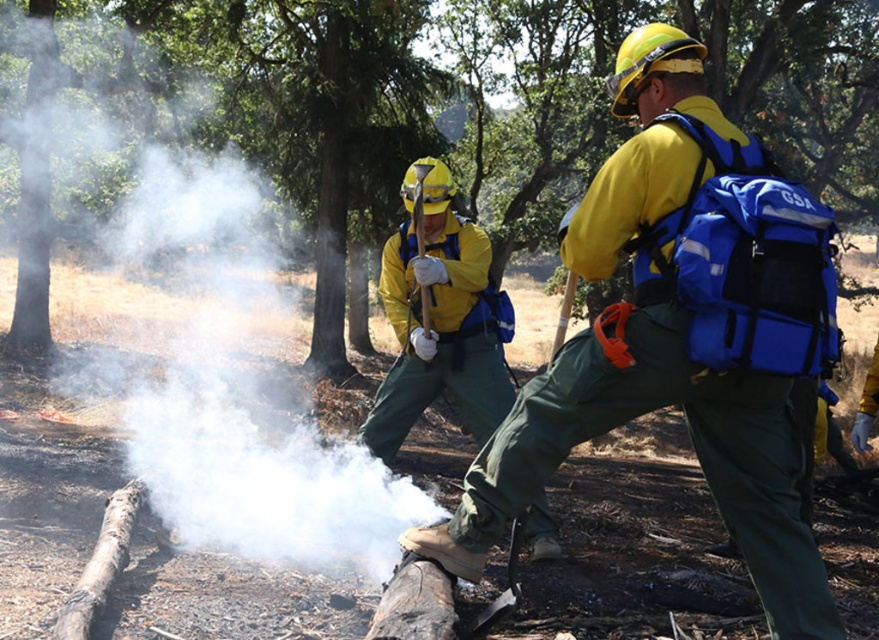
Is yellow reflective uniform at center positioned at the back of yellow matte helmet at center?

No, yellow reflective uniform at center is in front of yellow matte helmet at center.

Does point (734, 506) lie behind point (483, 237)?

No, it is not.

From the picture: Who is more distant from viewer, (620, 358) or (474, 355)?

The point (474, 355) is more distant.

Locate an element on the screen. The image size is (879, 640). yellow reflective uniform at center is located at coordinates tap(680, 332).

Which is above, yellow reflective uniform at center or yellow matte safety vest at center?

Positioned higher is yellow matte safety vest at center.

Can you confirm if yellow reflective uniform at center is shorter than yellow matte safety vest at center?

Incorrect, yellow reflective uniform at center's height does not fall short of yellow matte safety vest at center's.

Locate an element on the screen. yellow reflective uniform at center is located at coordinates (680, 332).

Is point (496, 182) positioned after point (384, 305)?

Yes, it is.

Does point (531, 230) come behind point (477, 284)?

Yes, point (531, 230) is farther from viewer.

The height and width of the screenshot is (640, 879). Identify the location of green textured log at center. (476, 97).